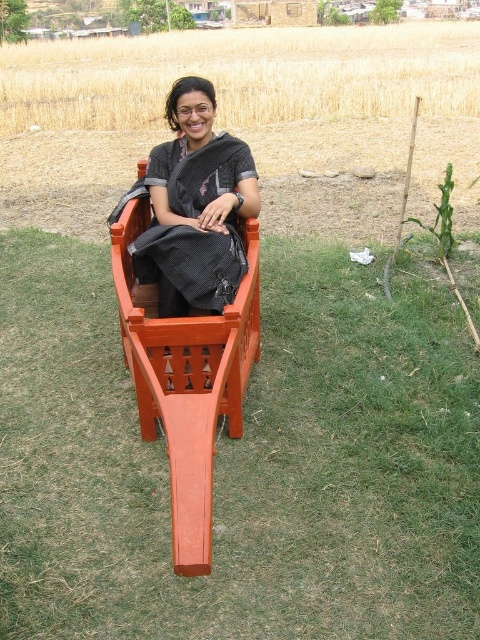
You are a photographer taking a picture of the orange wood chair at center and the black woven saree at center. Which object is located to the right of the other?

The orange wood chair at center is positioned on the right side of black woven saree at center.

You are a photographer standing 15 inches away from the orange wood chair at center. Can you reach the black woven saree at center without moving your position?

The orange wood chair at center is 12.92 inches away from the black woven saree at center. Since you are 15 inches away from the chair, you can reach the saree by extending your arm as the distance between them is less than your reach.

You are a photographer planning to take a portrait of the woman in the orange wood chair at center and the black woven saree at center. To ensure both are in focus, you need to know their relative sizes. Which object is bigger?

The orange wood chair at center is larger in size compared to the black woven saree at center, so you should adjust your camera settings to accommodate the size difference for proper focus.